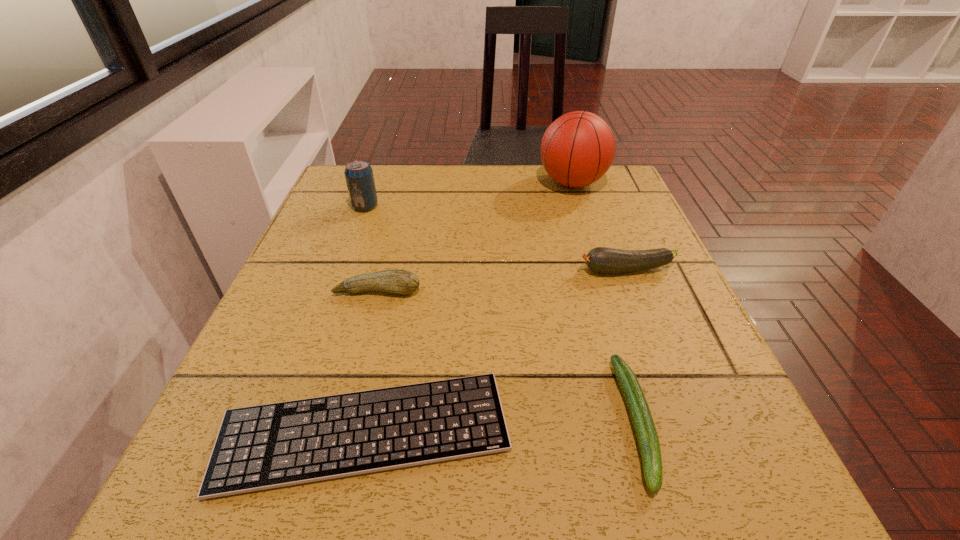
You are a GUI agent. You are given a task and a screenshot of the screen. Output one action in this format:
    pyautogui.click(x=<x>, y=<y>)
    Task: Click on the object that stands as the fourth closest to the computer keyboard
    The width and height of the screenshot is (960, 540).
    Given the screenshot: What is the action you would take?
    pyautogui.click(x=359, y=177)

Select which zucchini is the second closest to the fourth farthest object. Please provide its 2D coordinates. Your answer should be formatted as a tuple, i.e. [(x, y)], where the tuple contains the x and y coordinates of a point satisfying the conditions above.

[(646, 433)]

Where is `zucchini that is the nearest to the shortest zucchini`? The height and width of the screenshot is (540, 960). zucchini that is the nearest to the shortest zucchini is located at coordinates (600, 259).

Locate an element on the screen. vacant space that satisfies the following two spatial constraints: 1. at the blossom end of the fourth nearest object; 2. on the front-facing side of the shortest zucchini is located at coordinates (684, 421).

Locate an element on the screen. This screenshot has width=960, height=540. vacant space that satisfies the following two spatial constraints: 1. at the blossom end of the fourth nearest object; 2. on the front-facing side of the nearest zucchini is located at coordinates (684, 421).

The height and width of the screenshot is (540, 960). In order to click on vacant space that satisfies the following two spatial constraints: 1. at the blossom end of the farthest zucchini; 2. on the front side of the shortest object in this screenshot , I will do `click(688, 431)`.